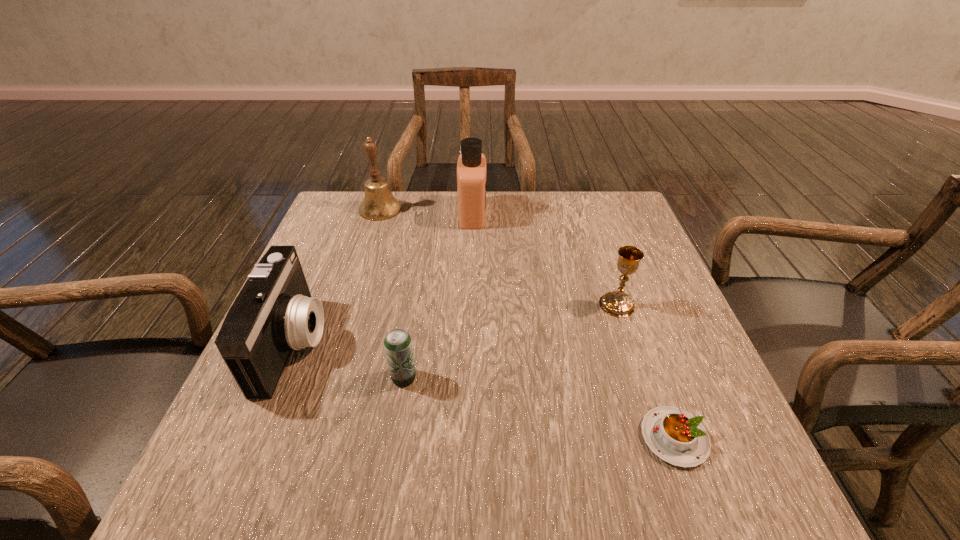
Locate an element on the screen. This screenshot has height=540, width=960. free space located on the lens of the camcorder is located at coordinates (450, 343).

The height and width of the screenshot is (540, 960). Identify the location of vacant space positioned on the front of the chalice. (637, 366).

Identify the location of vacant region located 0.130m on the front of the beer can. The height and width of the screenshot is (540, 960). (392, 455).

Identify the location of vacant space positioned 0.070m on the back of the pudding. The width and height of the screenshot is (960, 540). (653, 376).

Where is `bell located in the far edge section of the desktop`? The height and width of the screenshot is (540, 960). bell located in the far edge section of the desktop is located at coordinates (379, 204).

The width and height of the screenshot is (960, 540). I want to click on perfume positioned at the far edge, so click(x=471, y=167).

Identify the location of object positioned at the near edge. This screenshot has width=960, height=540. (675, 436).

Where is `bell present at the left edge`? The image size is (960, 540). bell present at the left edge is located at coordinates (379, 204).

At what (x,y) coordinates should I click in order to perform the action: click on camcorder that is positioned at the left edge. Please return your answer as a coordinate pair (x, y). The height and width of the screenshot is (540, 960). Looking at the image, I should click on (274, 312).

Image resolution: width=960 pixels, height=540 pixels. I want to click on chalice located at the right edge, so click(617, 303).